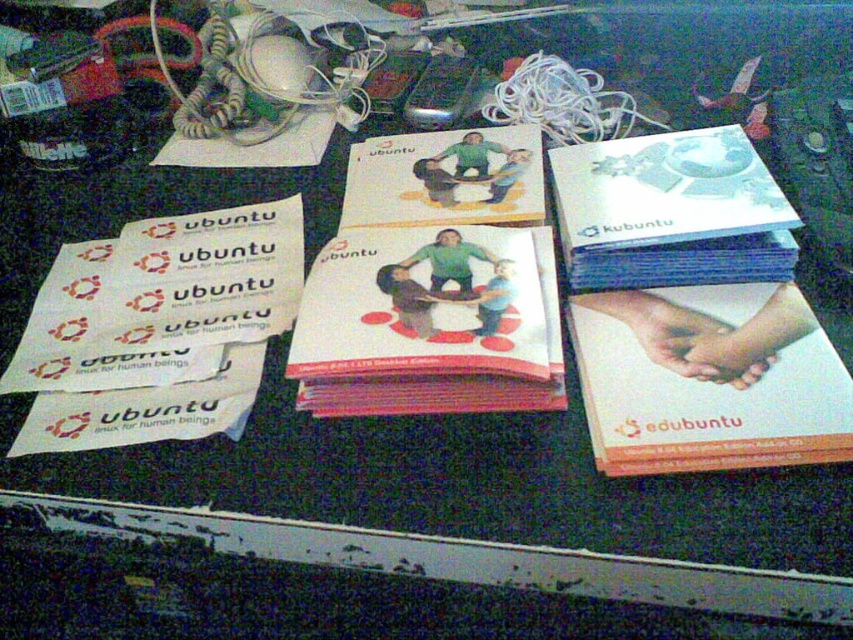
Question: Is white matte paper at center right to the right of white glossy book at upper right from the viewer's perspective?

Choices:
 (A) yes
 (B) no

Answer: (B)

Question: Is white matte paper at center right behind white glossy book at upper right?

Choices:
 (A) yes
 (B) no

Answer: (B)

Question: Which of the following is the closest to the observer?

Choices:
 (A) (688, 172)
 (B) (631, 408)

Answer: (B)

Question: Among these points, which one is farthest from the camera?

Choices:
 (A) (839, 451)
 (B) (701, 156)

Answer: (B)

Question: In this image, where is white matte paper at center right located relative to white glossy book at upper right?

Choices:
 (A) below
 (B) above

Answer: (A)